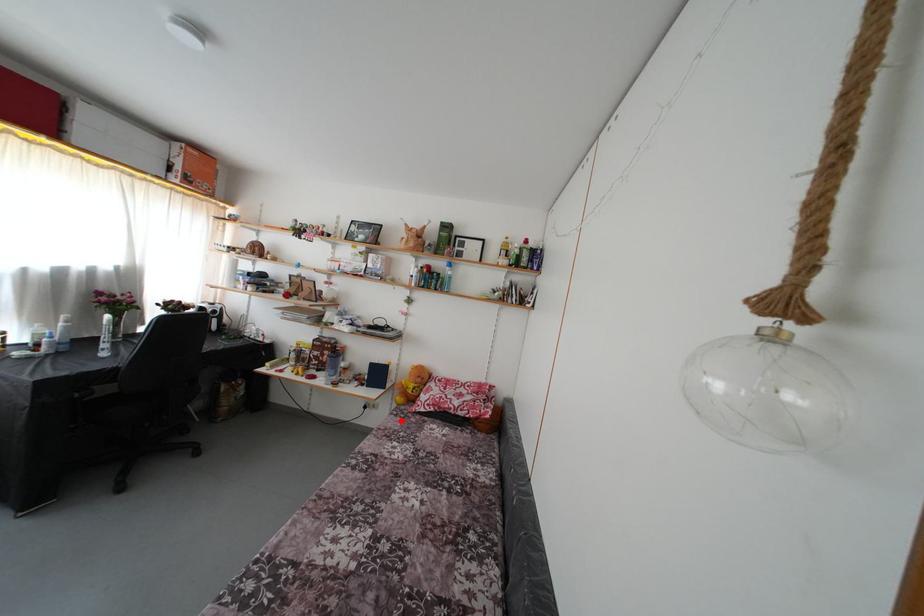
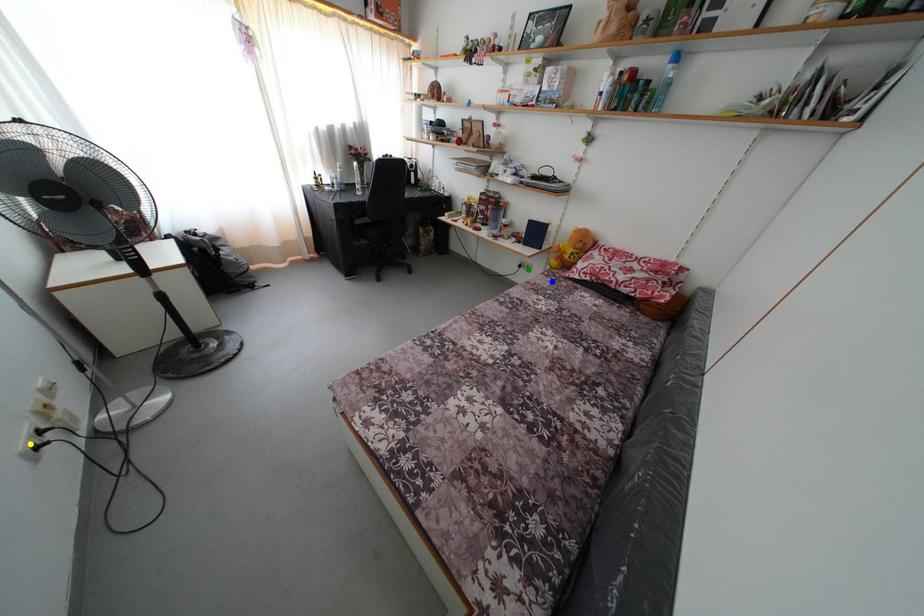
Question: I am providing you with two images of the same scene from different viewpoints. A red point is marked on the first image. You are given multiple points on the second image. Can you choose the point in image 2 that corresponds to the point in image 1?

Choices:
 (A) blue point
 (B) yellow point
 (C) green point

Answer: (A)